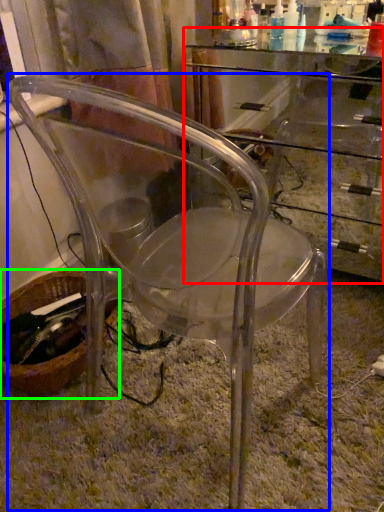
Question: Which is farther away from computer desk (highlighted by a red box)? chair (highlighted by a blue box) or basket (highlighted by a green box)?

Choices:
 (A) chair
 (B) basket

Answer: (B)